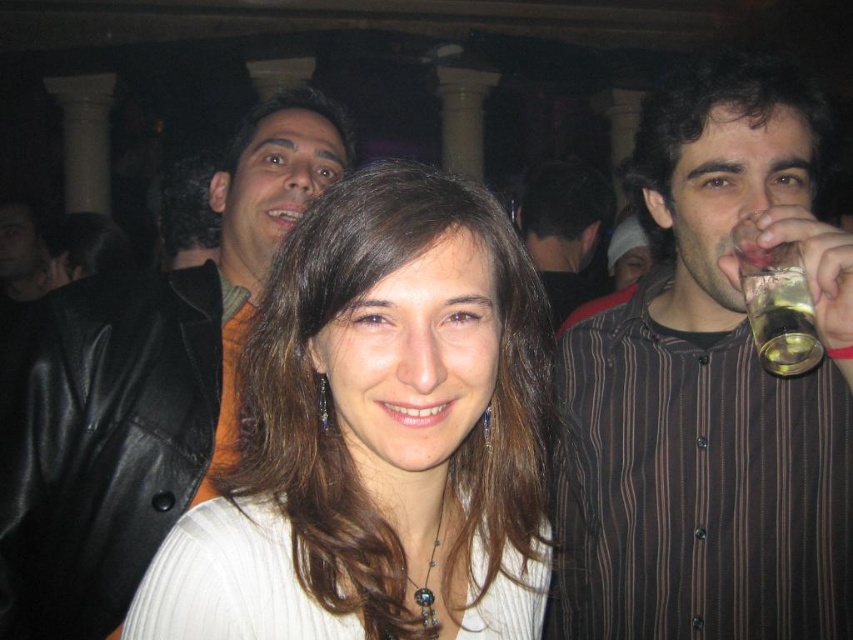
Question: Which of the following is the closest to the observer?

Choices:
 (A) (578, 264)
 (B) (216, 212)
 (C) (273, 353)
 (D) (103, 424)

Answer: (C)

Question: Does translucent glass at upper right appear over dark brown hair at left?

Choices:
 (A) yes
 (B) no

Answer: (B)

Question: Among these points, which one is farthest from the camera?

Choices:
 (A) (316, 176)
 (B) (592, 218)
 (C) (328, 337)

Answer: (B)

Question: Does translucent glass at upper right come behind dark brown hair at left?

Choices:
 (A) yes
 (B) no

Answer: (B)

Question: Which of the following is the closest to the observer?

Choices:
 (A) black leather jacket at upper left
 (B) white matte sweater at center
 (C) translucent glass at upper right
 (D) dark brown hair at left

Answer: (B)

Question: Is brown striped shirt at right bigger than dark brown hair at left?

Choices:
 (A) no
 (B) yes

Answer: (A)